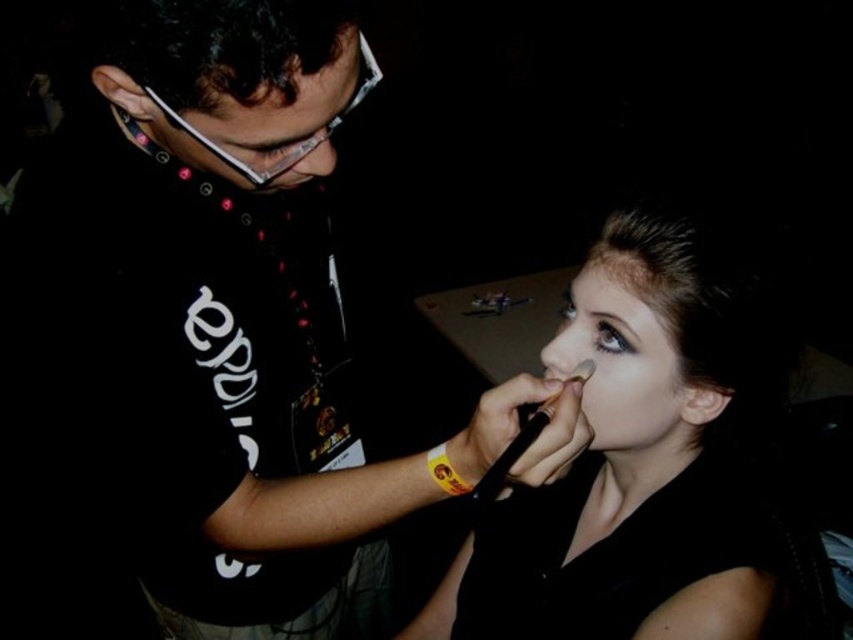
You are a guest at an event and notice two items of clothing. The matte black shirt at center and the matte black glasses at upper left. Which item is positioned higher up in the image?

The matte black shirt at center is taller than the matte black glasses at upper left, so the matte black shirt at center is positioned higher up in the image.